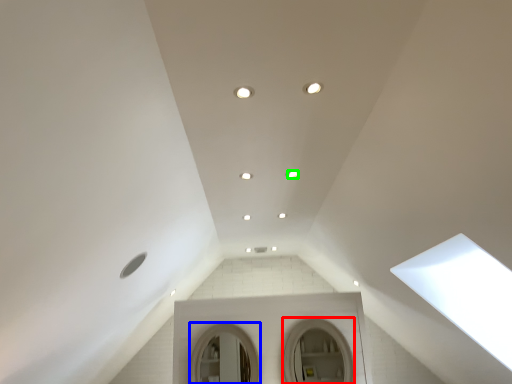
Question: Which is nearer to the mirror (highlighted by a red box)? mirror (highlighted by a blue box) or lighting (highlighted by a green box).

Choices:
 (A) mirror
 (B) lighting

Answer: (A)